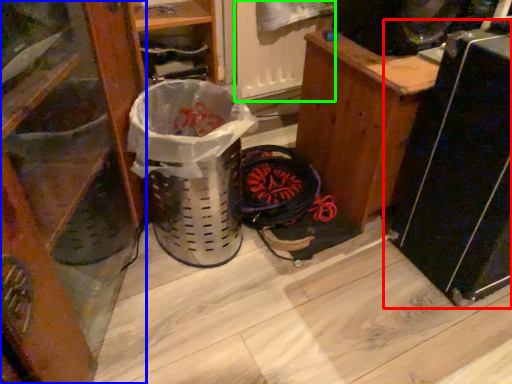
Question: Which object is the farthest from appliance (highlighted by a red box)? Choose among these: furniture (highlighted by a blue box) or screen door (highlighted by a green box).

Choices:
 (A) furniture
 (B) screen door

Answer: (A)